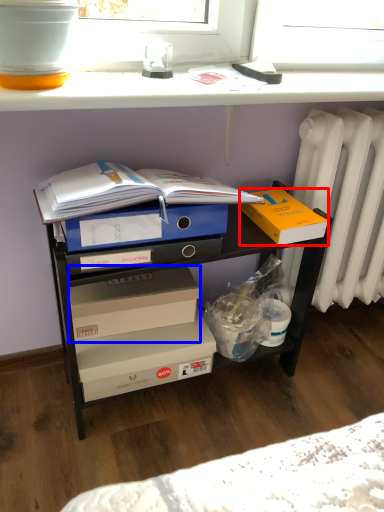
Question: Which point is further to the camera, box (highlighted by a red box) or box (highlighted by a blue box)?

Choices:
 (A) box
 (B) box

Answer: (B)